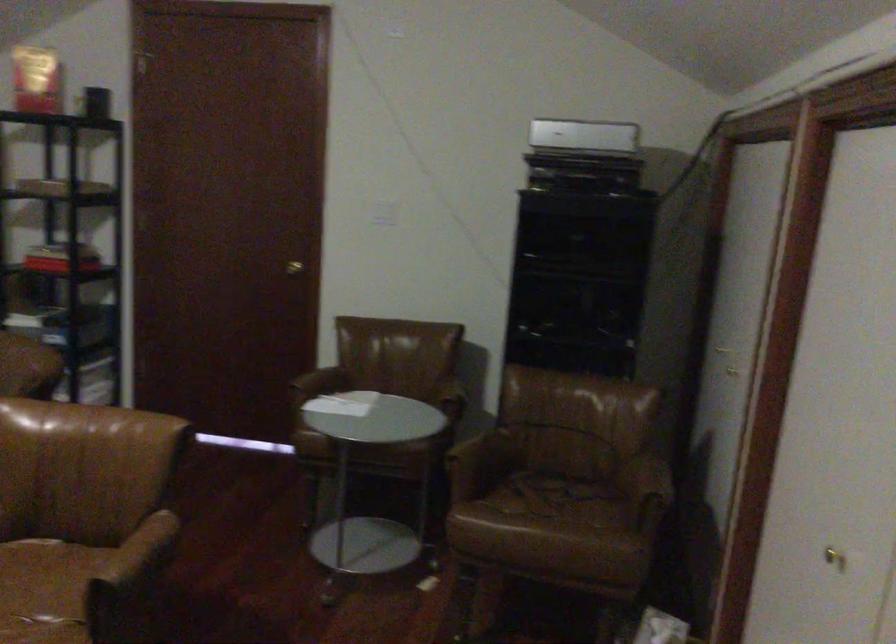
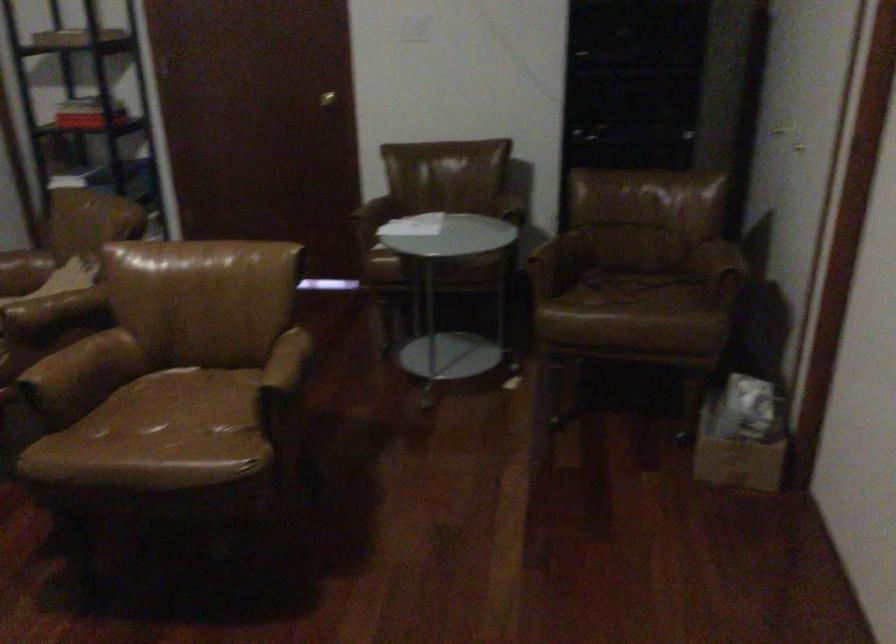
Question: Based on the continuous images, in which direction is the camera rotating? Reply with the corresponding letter.

Choices:
 (A) Left
 (B) Right
 (C) Up
 (D) Down

Answer: (D)